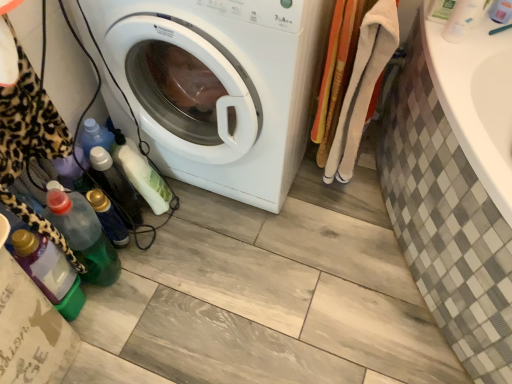
I want to click on empty space that is to the right of soft cotton towels at right, so click(x=367, y=178).